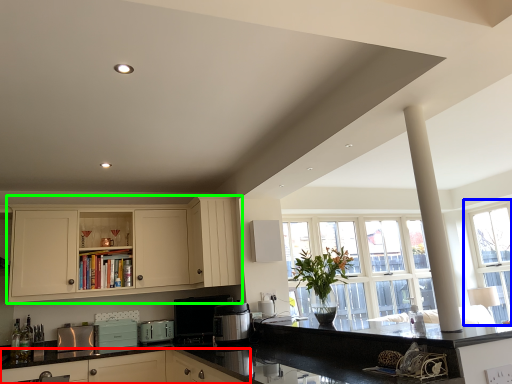
Question: Which object is positioned closest to cabinetry (highlighted by a red box)? Select from window (highlighted by a blue box) and cabinetry (highlighted by a green box).

Choices:
 (A) window
 (B) cabinetry

Answer: (B)